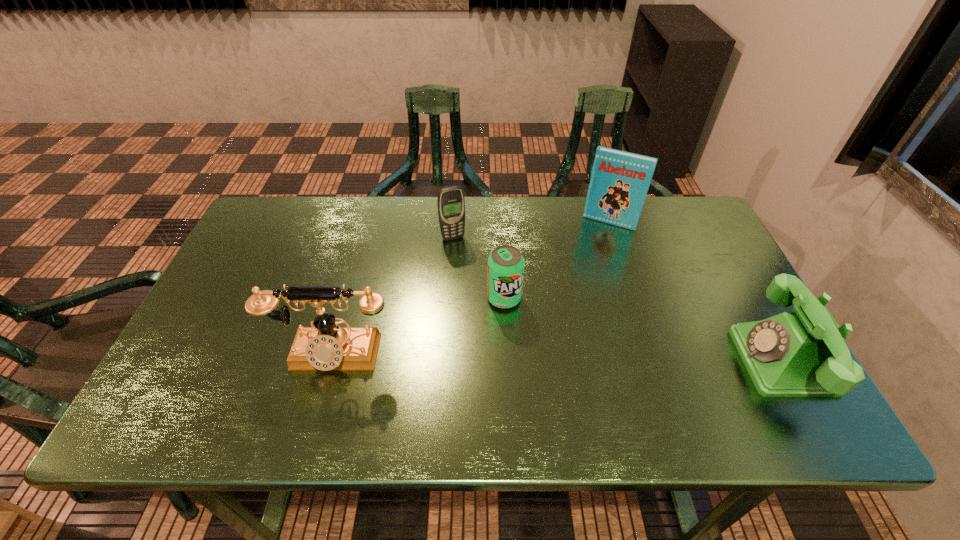
Where is `the leftmost object`? The image size is (960, 540). the leftmost object is located at coordinates (325, 346).

In order to click on the left telephone in this screenshot , I will do `click(325, 346)`.

Image resolution: width=960 pixels, height=540 pixels. Identify the location of the rightmost object. (793, 354).

Locate an element on the screen. Image resolution: width=960 pixels, height=540 pixels. the right telephone is located at coordinates (793, 354).

Locate an element on the screen. The image size is (960, 540). the second farthest object is located at coordinates (451, 204).

Where is `cellular telephone`? Image resolution: width=960 pixels, height=540 pixels. cellular telephone is located at coordinates (451, 204).

This screenshot has height=540, width=960. What are the coordinates of `book` in the screenshot? It's located at (620, 180).

You are a GUI agent. You are given a task and a screenshot of the screen. Output one action in this format:
    pyautogui.click(x=<x>, y=<y>)
    Task: Click on the farthest object
    
    Given the screenshot: What is the action you would take?
    pyautogui.click(x=620, y=180)

Image resolution: width=960 pixels, height=540 pixels. Identify the location of the third farthest object. (505, 270).

This screenshot has height=540, width=960. In order to click on the third object from left to right in this screenshot , I will do `click(505, 270)`.